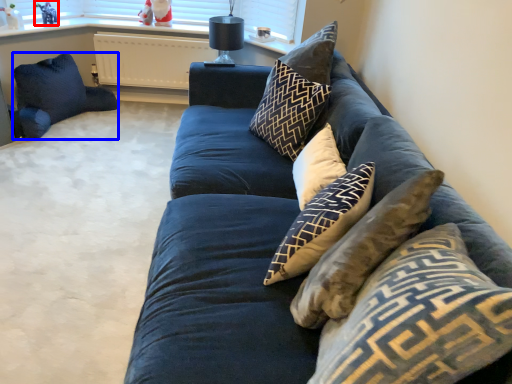
Question: Which of the following is the farthest to the observer, toy (highlighted by a red box) or pillow (highlighted by a blue box)?

Choices:
 (A) toy
 (B) pillow

Answer: (A)